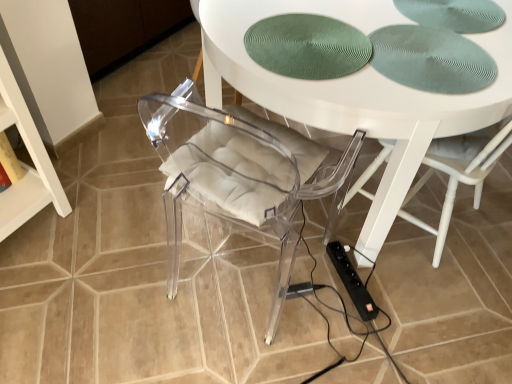
The width and height of the screenshot is (512, 384). In order to click on vacant space to the right of black plastic extension cord at lower right in this screenshot , I will do `click(400, 290)`.